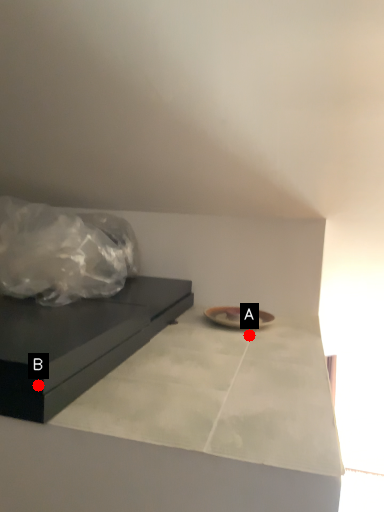
Question: Two points are circled on the image, labeled by A and B beside each circle. Which point is farther to the camera?

Choices:
 (A) A is further
 (B) B is further

Answer: (A)